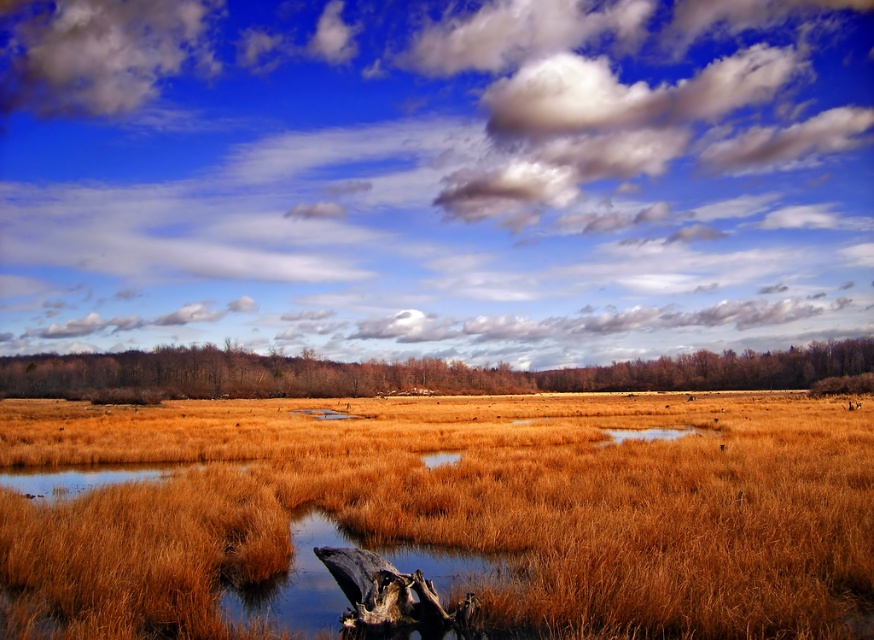
You are standing in the marshy area and notice two elements in the scene. Which of the following is smaller in size between the dry grass at center and the white fluffy cloud at upper left?

The dry grass at center is smaller than the white fluffy cloud at upper left according to the description.